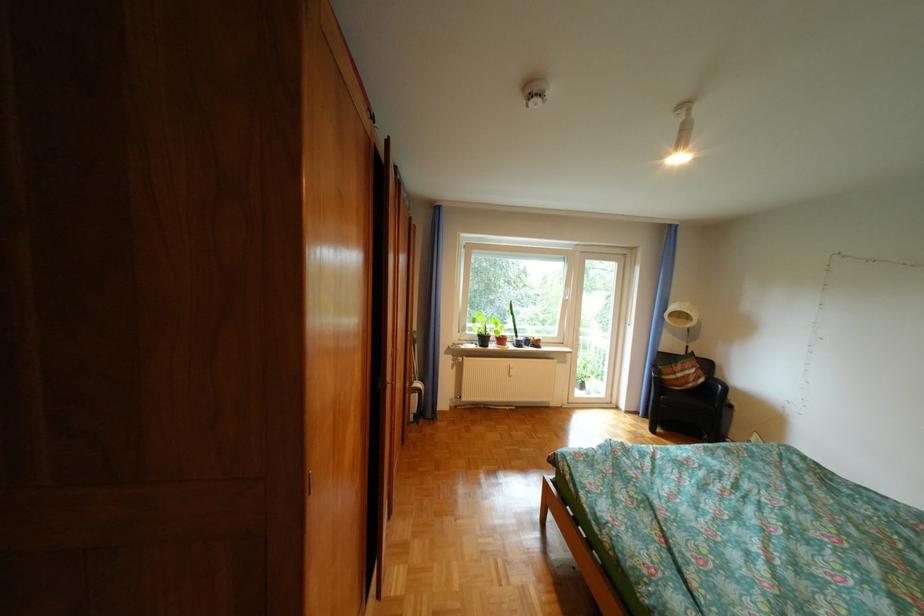
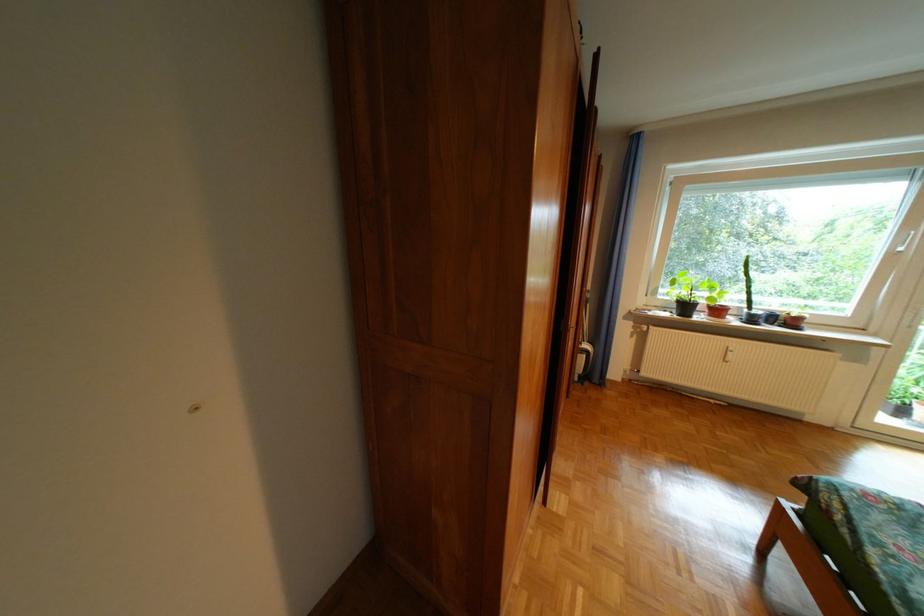
Where in the second image is the point corresponding to point 487,347 from the first image?

(679, 315)